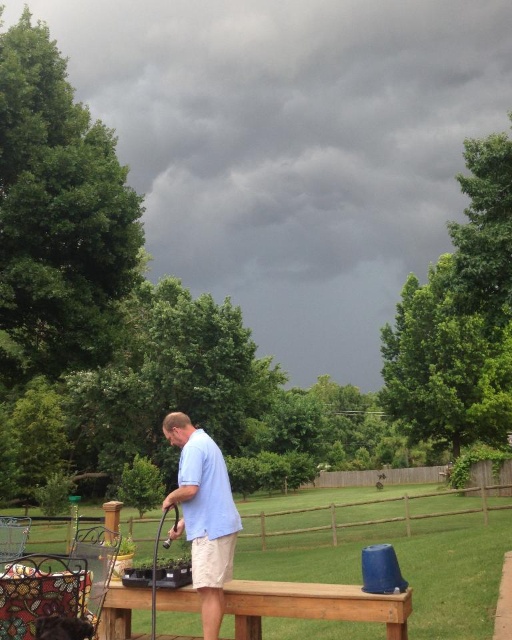
Question: Which point is closer to the camera?

Choices:
 (A) light blue shirt at center
 (B) brown wooden picnic table at center

Answer: (B)

Question: Does brown wooden picnic table at center appear over light blue shirt at center?

Choices:
 (A) no
 (B) yes

Answer: (A)

Question: Does brown wooden picnic table at center come behind light blue shirt at center?

Choices:
 (A) no
 (B) yes

Answer: (A)

Question: Does brown wooden picnic table at center appear over light blue shirt at center?

Choices:
 (A) yes
 (B) no

Answer: (B)

Question: Which of the following is the farthest from the observer?

Choices:
 (A) brown wooden picnic table at center
 (B) light blue shirt at center

Answer: (B)